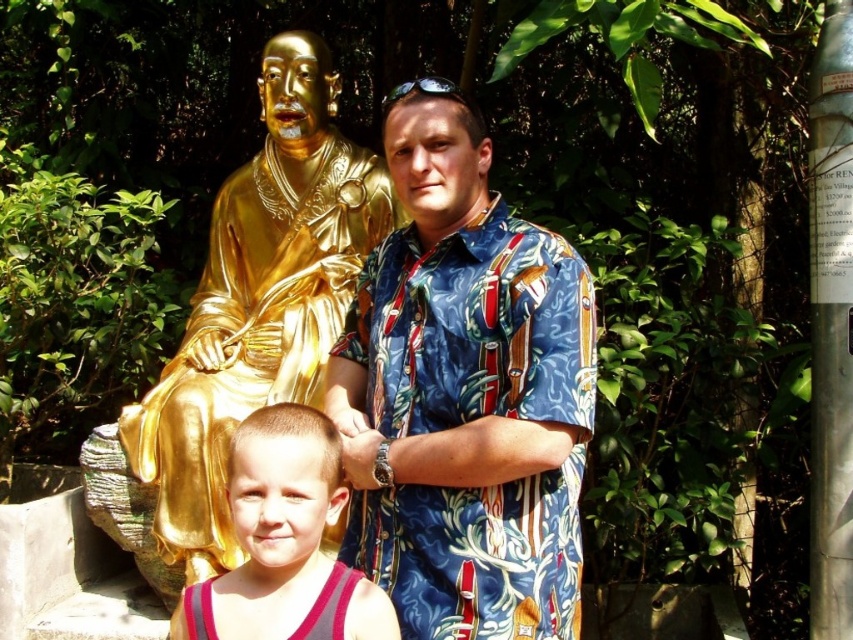
Question: Can you confirm if blue printed shirt at center is thinner than matte pink tank top at center?

Choices:
 (A) no
 (B) yes

Answer: (A)

Question: Does gold shiny statue at upper left have a lesser width compared to matte pink tank top at center?

Choices:
 (A) yes
 (B) no

Answer: (B)

Question: Which object is positioned closest to the gold shiny statue at upper left?

Choices:
 (A) pink fabric tank top at lower center
 (B) matte pink tank top at center

Answer: (B)

Question: Which point appears closest to the camera in this image?

Choices:
 (A) (183, 384)
 (B) (415, 292)

Answer: (B)

Question: Is matte pink tank top at center thinner than pink fabric tank top at lower center?

Choices:
 (A) no
 (B) yes

Answer: (A)

Question: Among these objects, which one is nearest to the camera?

Choices:
 (A) matte pink tank top at center
 (B) pink fabric tank top at lower center

Answer: (B)